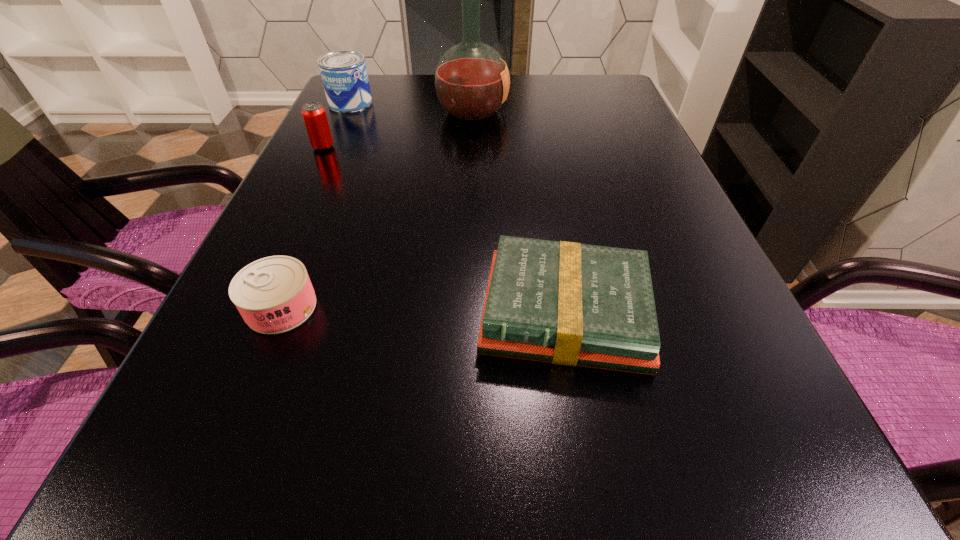
Where is `free spot between the second shortest can and the farthest can`? The width and height of the screenshot is (960, 540). free spot between the second shortest can and the farthest can is located at coordinates (337, 125).

Find the location of a particular element. The image size is (960, 540). object that stands as the third closest to the hardback book is located at coordinates (314, 114).

Choose which object is the fourth nearest neighbor to the farthest can. Please provide its 2D coordinates. Your answer should be formatted as a tuple, i.e. [(x, y)], where the tuple contains the x and y coordinates of a point satisfying the conditions above.

[(566, 303)]

Where is `the second closest can relative to the liquor`? This screenshot has width=960, height=540. the second closest can relative to the liquor is located at coordinates (314, 114).

Find the location of a particular element. can that stands as the closest to the third shortest object is located at coordinates (344, 75).

In order to click on free location that satisfies the following two spatial constraints: 1. on the front label of the nearest can; 2. on the left side of the farthest can in this screenshot , I will do `click(256, 307)`.

In order to click on vacant position in the image that satisfies the following two spatial constraints: 1. on the front label of the hardback book; 2. on the left side of the liquor in this screenshot , I will do (x=468, y=314).

Image resolution: width=960 pixels, height=540 pixels. I want to click on vacant space that satisfies the following two spatial constraints: 1. on the front label of the farthest can; 2. on the right side of the shortest can, so click(x=256, y=307).